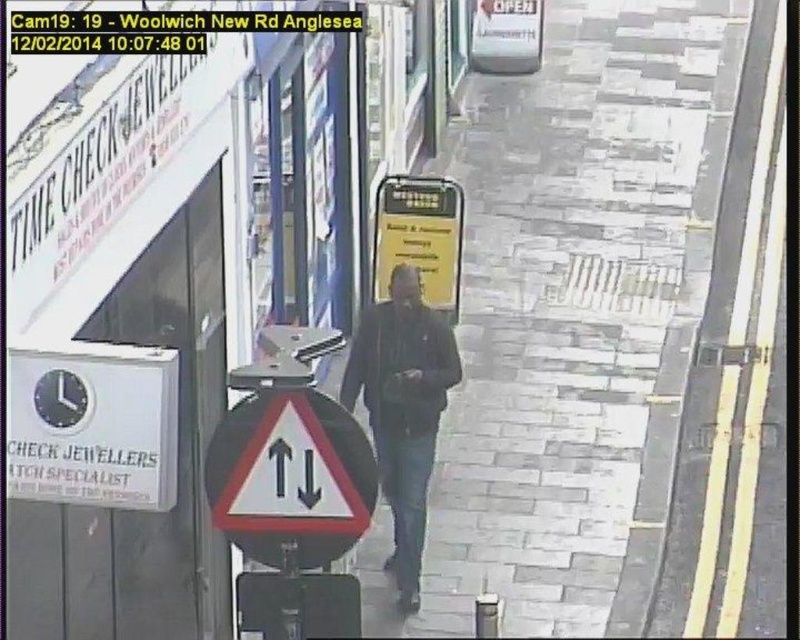
You are a pedestrian standing on the pedestrian street with the paved surface. You see the dark blue jacket at center and the yellow paper sign at center. Which object is positioned higher in the image?

The yellow paper sign at center is positioned higher than the dark blue jacket at center in the image.